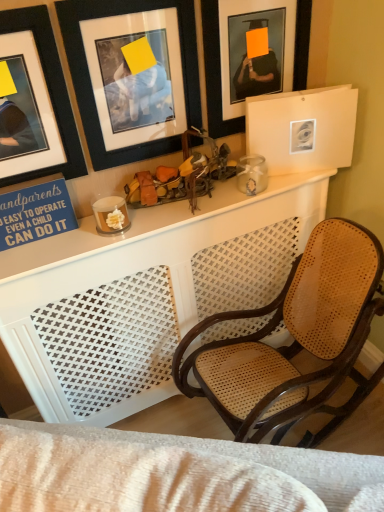
Question: Does black matte picture frame at upper left, the 3th picture frame in the right-to-left sequence, have a larger size compared to matte black picture frame at upper center, the first picture frame in the right-to-left sequence?

Choices:
 (A) yes
 (B) no

Answer: (A)

Question: From a real-world perspective, is black matte picture frame at upper left, acting as the 1th picture frame starting from the left, located higher than matte black picture frame at upper center, which appears as the third picture frame when viewed from the left?

Choices:
 (A) yes
 (B) no

Answer: (B)

Question: Does black matte picture frame at upper left, acting as the 1th picture frame starting from the left, have a greater height compared to matte black picture frame at upper center, which appears as the third picture frame when viewed from the left?

Choices:
 (A) yes
 (B) no

Answer: (B)

Question: Can you confirm if black matte picture frame at upper left, the 3th picture frame in the right-to-left sequence, is smaller than matte black picture frame at upper center, the first picture frame in the right-to-left sequence?

Choices:
 (A) no
 (B) yes

Answer: (A)

Question: Does black matte picture frame at upper left, acting as the 1th picture frame starting from the left, have a lesser height compared to matte black picture frame at upper center, which appears as the third picture frame when viewed from the left?

Choices:
 (A) no
 (B) yes

Answer: (A)

Question: Is black matte picture frame at upper left, the 3th picture frame in the right-to-left sequence, thinner than matte black picture frame at upper center, which appears as the third picture frame when viewed from the left?

Choices:
 (A) yes
 (B) no

Answer: (B)

Question: From the image's perspective, is black matte picture frame at upper left, which appears as the second picture frame when viewed from the left, beneath black matte picture frame at upper left, acting as the 1th picture frame starting from the left?

Choices:
 (A) yes
 (B) no

Answer: (B)

Question: Is black matte picture frame at upper left, which appears as the second picture frame when viewed from the left, at the left side of black matte picture frame at upper left, the 3th picture frame in the right-to-left sequence?

Choices:
 (A) no
 (B) yes

Answer: (A)

Question: Considering the relative sizes of black matte picture frame at upper left, which appears as the second picture frame when viewed from the left, and black matte picture frame at upper left, the 3th picture frame in the right-to-left sequence, in the image provided, is black matte picture frame at upper left, which appears as the second picture frame when viewed from the left, smaller than black matte picture frame at upper left, the 3th picture frame in the right-to-left sequence,?

Choices:
 (A) no
 (B) yes

Answer: (A)

Question: From a real-world perspective, is black matte picture frame at upper left, which is the 2th picture frame in right-to-left order, on top of black matte picture frame at upper left, acting as the 1th picture frame starting from the left?

Choices:
 (A) yes
 (B) no

Answer: (A)

Question: Is black matte picture frame at upper left, which appears as the second picture frame when viewed from the left, oriented away from black matte picture frame at upper left, the 3th picture frame in the right-to-left sequence?

Choices:
 (A) yes
 (B) no

Answer: (B)

Question: Could black matte picture frame at upper left, acting as the 1th picture frame starting from the left, be considered to be inside black matte picture frame at upper left, which appears as the second picture frame when viewed from the left?

Choices:
 (A) no
 (B) yes

Answer: (A)

Question: From the image's perspective, is matte black picture frame at upper center, which appears as the third picture frame when viewed from the left, on top of black matte picture frame at upper left, the 3th picture frame in the right-to-left sequence?

Choices:
 (A) no
 (B) yes

Answer: (B)